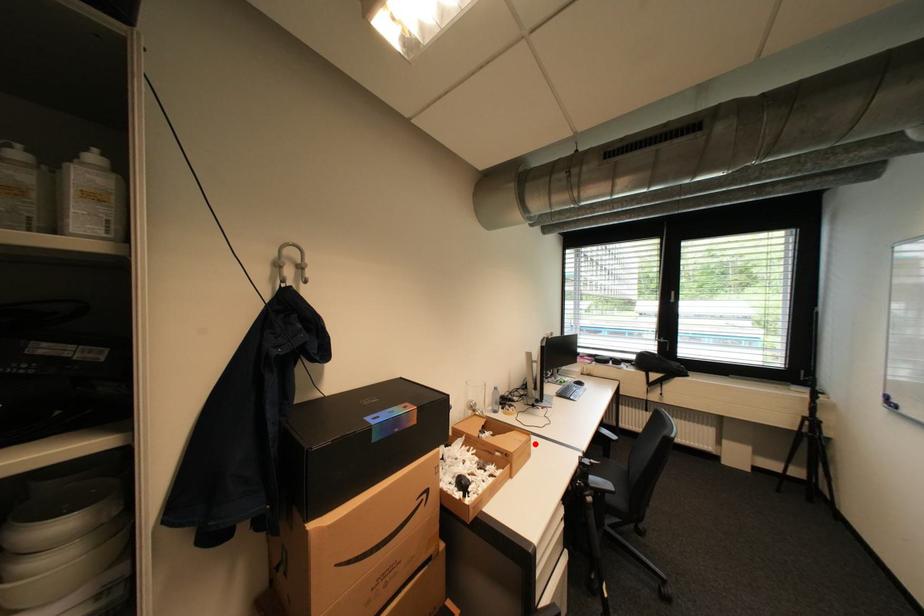
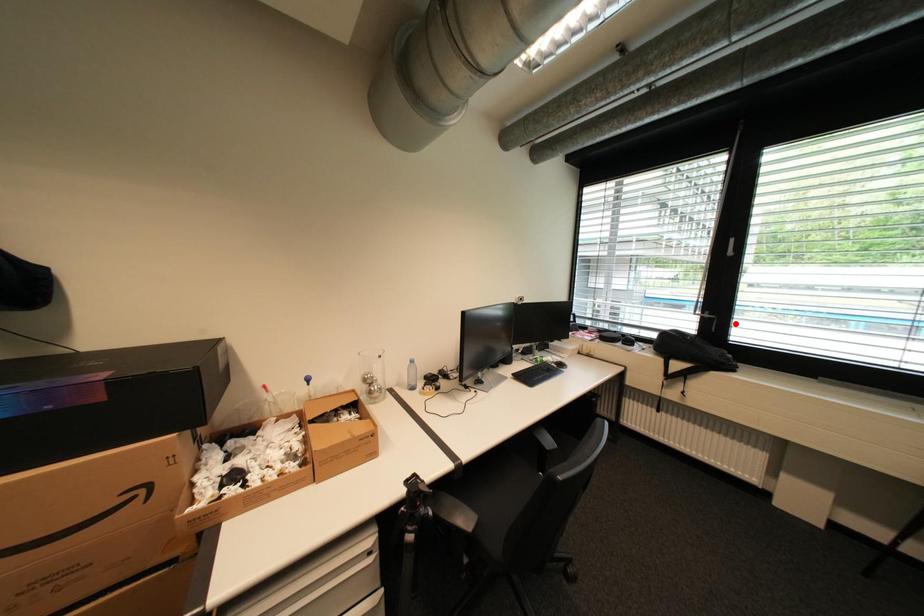
I am providing you with two images of the same scene from different viewpoints. A red point is marked on the first image and another point is marked on the second image. Is the marked point in image1 the same physical position as the marked point in image2?

No